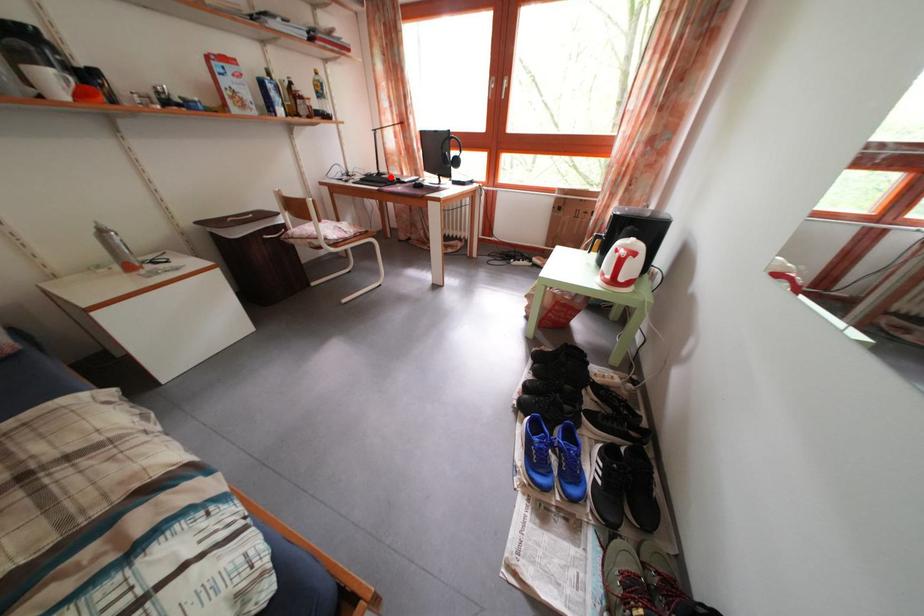
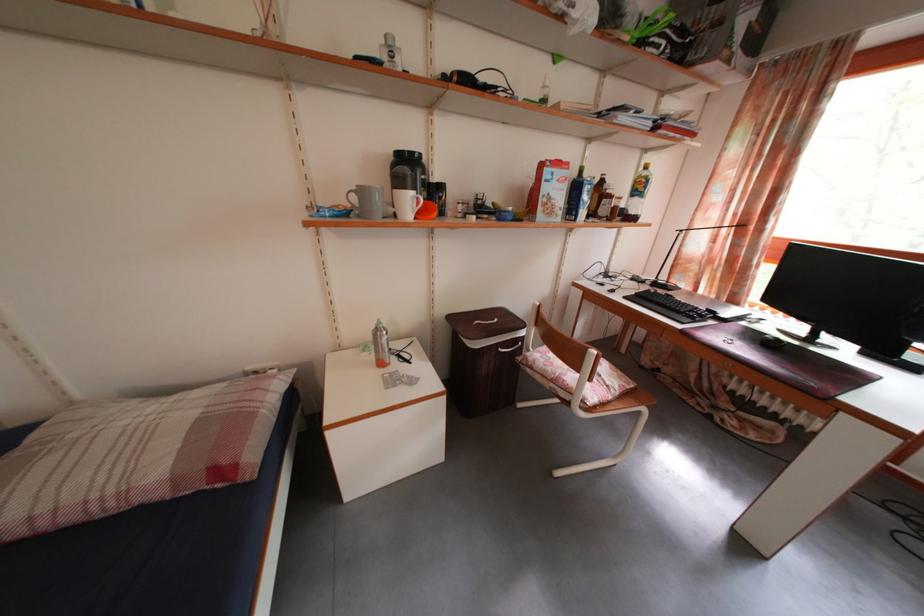
Locate, in the second image, the point that corresponds to the highlighted location in the first image.

(671, 285)